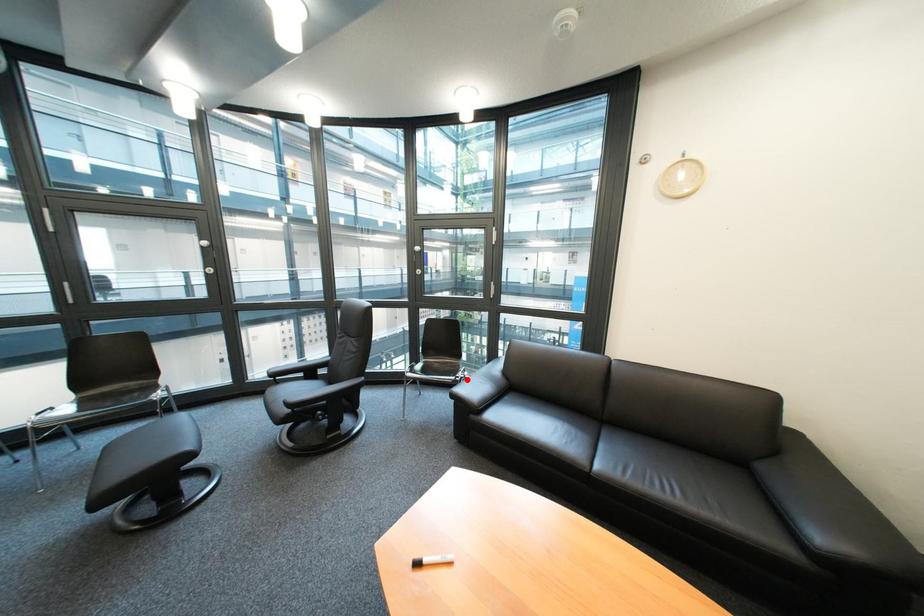
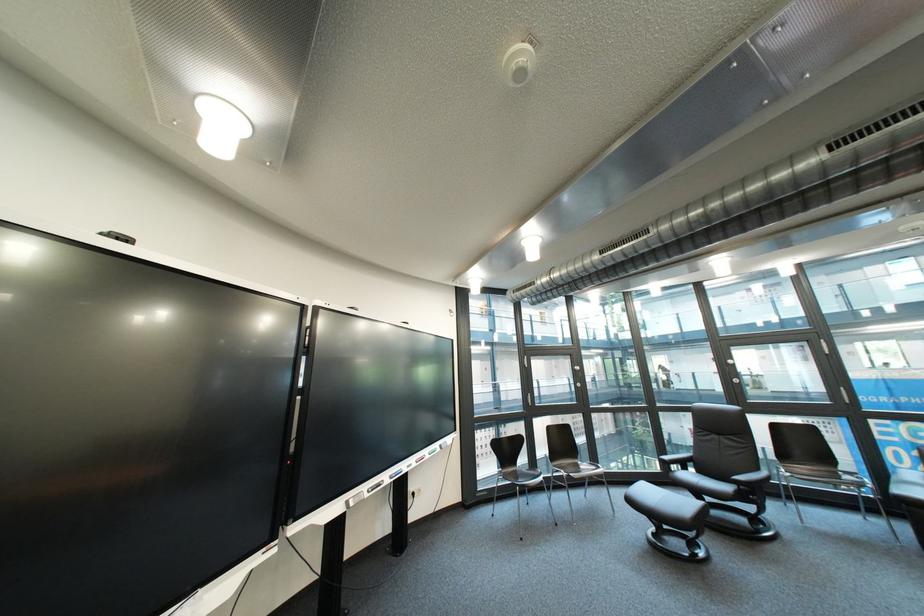
The point at the highlighted location is marked in the first image. Where is the corresponding point in the second image?

(883, 485)